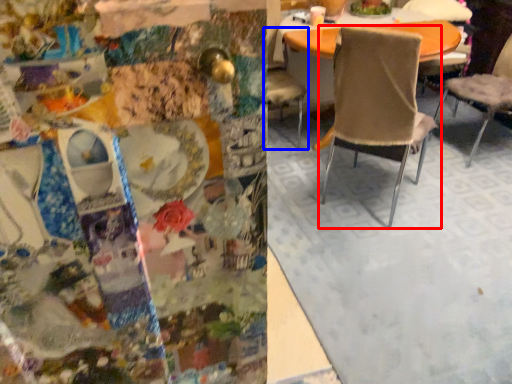
Question: Which object is further to the camera taking this photo, chair (highlighted by a red box) or chair (highlighted by a blue box)?

Choices:
 (A) chair
 (B) chair

Answer: (B)